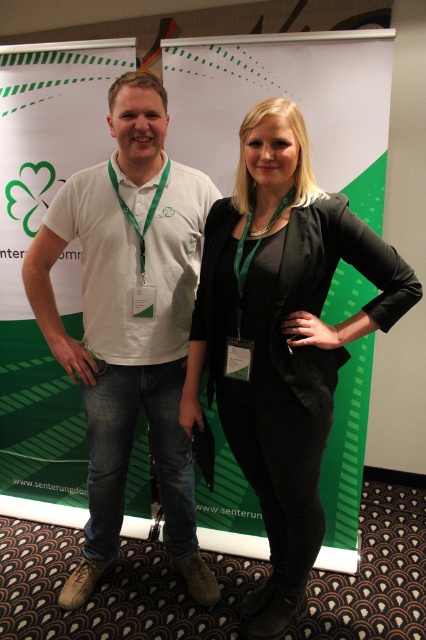
Question: Which point is closer to the camera?

Choices:
 (A) (201, 342)
 (B) (186, 44)
 (C) (112, 120)

Answer: (C)

Question: Can you confirm if green fabric banner at center is positioned to the right of black leather blazer at center?

Choices:
 (A) yes
 (B) no

Answer: (B)

Question: Considering the relative positions of black leather blazer at center and white cotton polo shirt at left in the image provided, where is black leather blazer at center located with respect to white cotton polo shirt at left?

Choices:
 (A) below
 (B) above

Answer: (A)

Question: Which of the following is the farthest from the observer?

Choices:
 (A) black leather blazer at center
 (B) white cotton polo shirt at left
 (C) green fabric banner at center

Answer: (C)

Question: Which object is positioned closest to the black leather blazer at center?

Choices:
 (A) white cotton polo shirt at left
 (B) green fabric banner at center

Answer: (A)

Question: From the image, what is the correct spatial relationship of black leather blazer at center in relation to white cotton polo shirt at left?

Choices:
 (A) left
 (B) right

Answer: (B)